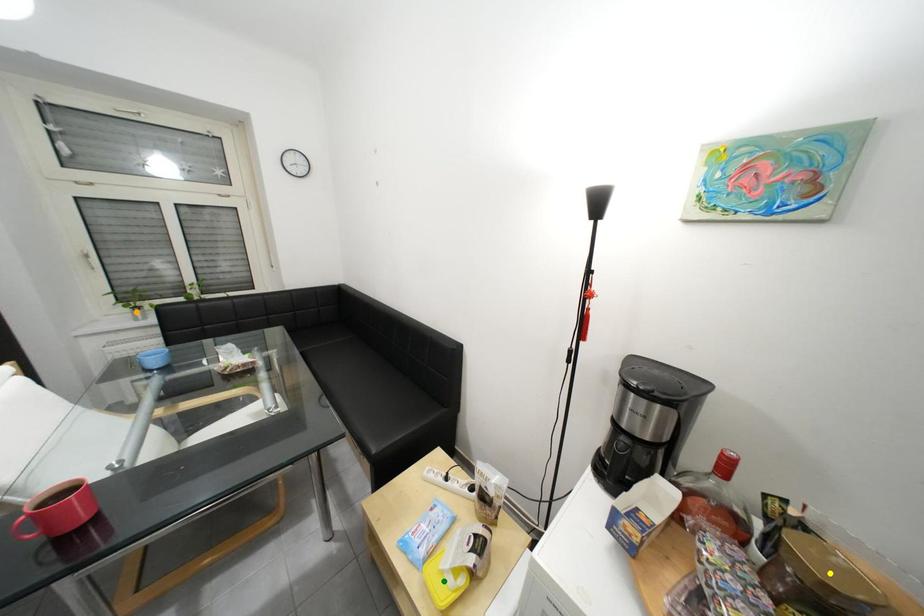
Order these from nearest to farthest:
- yellow point
- orange point
- green point

yellow point → green point → orange point